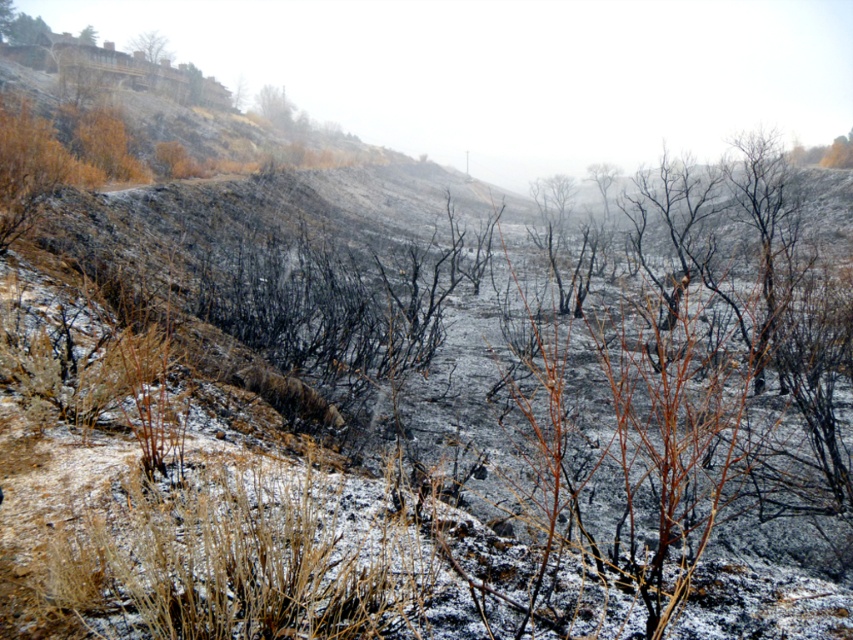
Who is positioned more to the left, brown dry branches at center or brown wood tree at upper left?

brown wood tree at upper left

Does point (598, 172) come farther from viewer compared to point (90, 36)?

Yes, it is.

In order to click on brown dry branches at center in this screenshot , I will do `click(602, 180)`.

Does brown dry branches at upper center appear on the right side of brown wood tree at upper left?

Correct, you'll find brown dry branches at upper center to the right of brown wood tree at upper left.

Looking at this image, is brown dry branches at upper center taller than brown wood tree at upper left?

In fact, brown dry branches at upper center may be shorter than brown wood tree at upper left.

Is point (260, 113) positioned before point (90, 24)?

Yes, it is in front of point (90, 24).

The image size is (853, 640). Identify the location of brown dry branches at upper center. (274, 108).

Is charred wood tree at center closer to the viewer compared to brown dry branches at center?

That is True.

Is point (775, 273) more distant than point (608, 214)?

No, (775, 273) is in front of (608, 214).

Where is `charred wood tree at center`? Image resolution: width=853 pixels, height=640 pixels. charred wood tree at center is located at coordinates (767, 228).